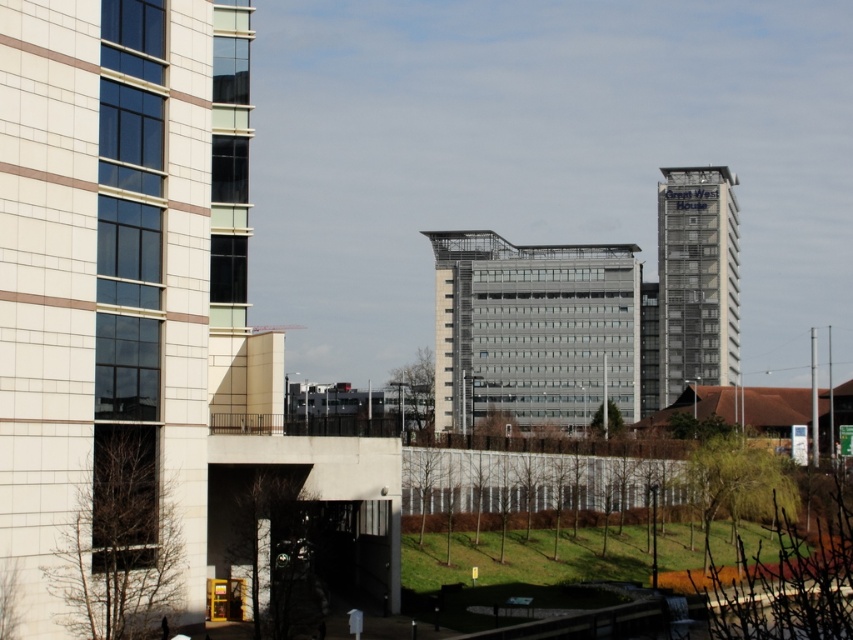
You are standing at the concrete entrance at center and want to reach the metallic glass building at center. Which direction should you head towards?

The metallic glass building at center is to the right of the concrete entrance at center, so you should head towards the right.

Consider the image. You are standing in the urban landscape and want to take a photo of both the metallic glass building at center and the glassy silver tower at upper right. If your camera has a maximum zoom range of 50 feet, will you be able to capture both buildings in a single frame without moving closer?

The metallic glass building at center is 44.94 feet away from the glassy silver tower at upper right. Since the distance between them is less than the camera maximum zoom range of 50 feet, you can capture both buildings in a single frame without moving closer.

You are an architect analyzing the urban skyline. Based on the image, which building is taller between the metallic glass building at center and the glassy silver tower at upper right?

The glassy silver tower at upper right is taller than the metallic glass building at center according to the description.